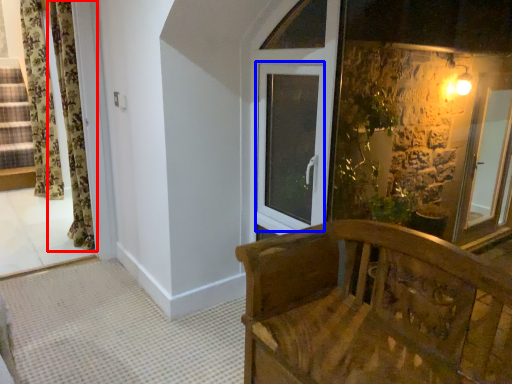
Question: Which object appears closest to the camera in this image, curtain (highlighted by a red box) or window (highlighted by a blue box)?

Choices:
 (A) curtain
 (B) window

Answer: (B)